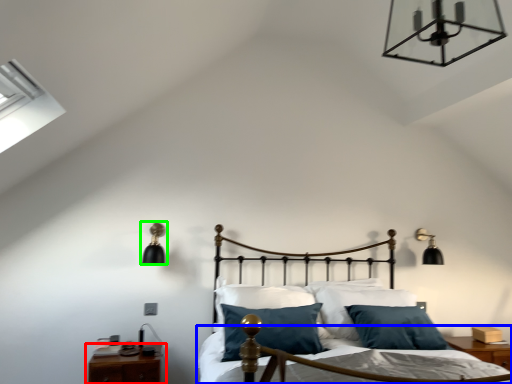
Question: Which is farther away from nightstand (highlighted by a red box)? bed frame (highlighted by a blue box) or lamp (highlighted by a green box)?

Choices:
 (A) bed frame
 (B) lamp

Answer: (A)